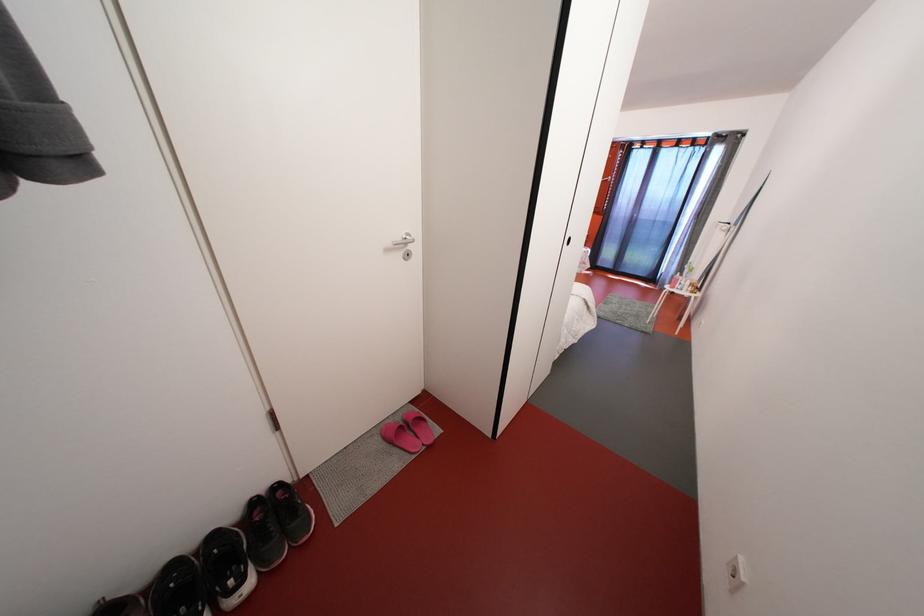
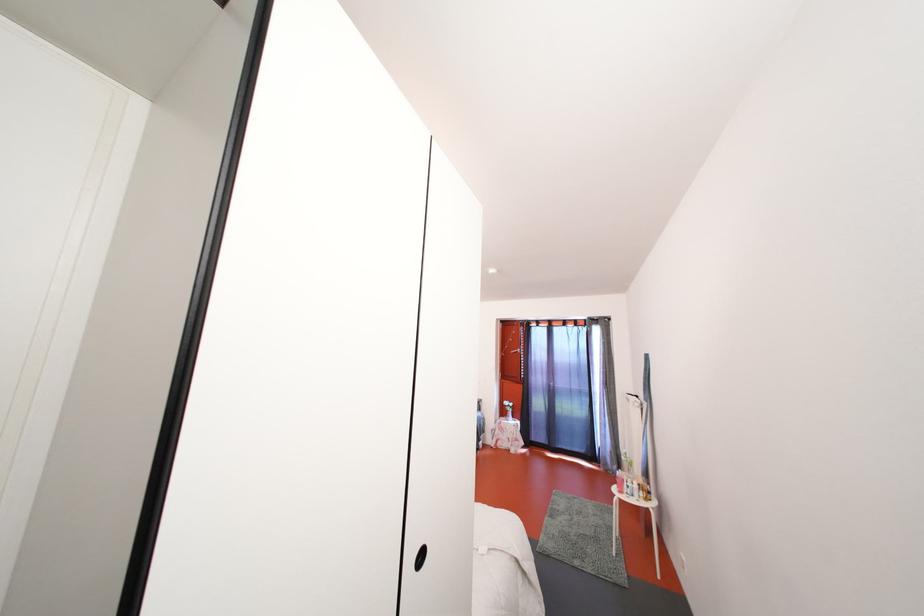
How did the camera likely rotate?

The rotation direction of the camera is right-up.